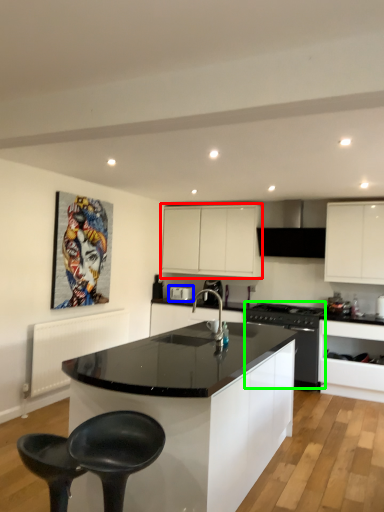
Question: Which is nearer to the cabinetry (highlighted by a red box)? appliance (highlighted by a blue box) or kitchen appliance (highlighted by a green box).

Choices:
 (A) appliance
 (B) kitchen appliance

Answer: (A)